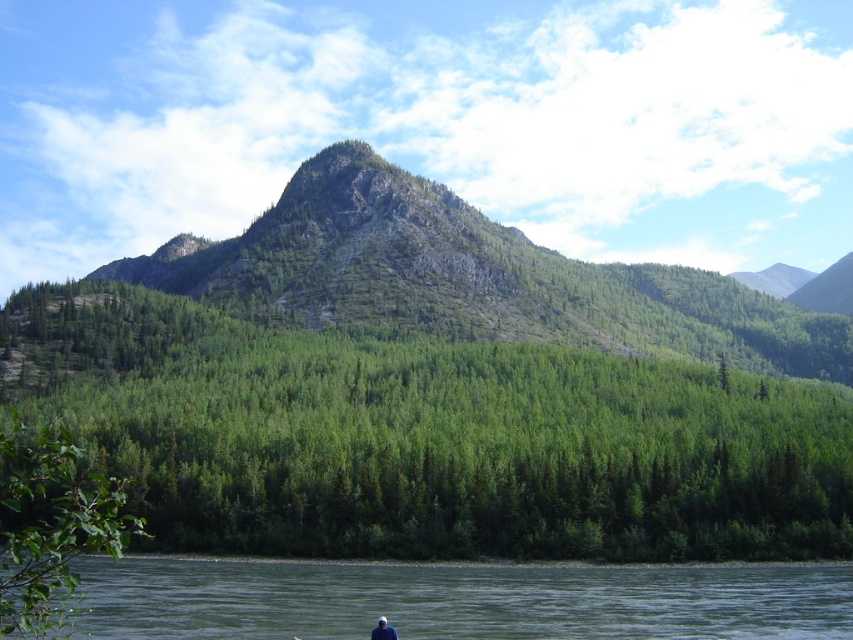
Who is more distant from viewer, (401, 515) or (390, 637)?

The point (401, 515) is more distant.

Measure the distance between green leafy forest at center and camera.

green leafy forest at center is 136.74 meters from camera.

Image resolution: width=853 pixels, height=640 pixels. I want to click on green leafy forest at center, so click(x=422, y=436).

Does green smooth water at lower center come in front of blue fabric person at lower center?

Yes, it is.

Consider the image. Does green smooth water at lower center have a lesser width compared to blue fabric person at lower center?

In fact, green smooth water at lower center might be wider than blue fabric person at lower center.

Where is `green smooth water at lower center`? This screenshot has height=640, width=853. green smooth water at lower center is located at coordinates (457, 598).

Does green leafy forest at center have a lesser width compared to green smooth water at lower center?

No.

At what (x,y) coordinates should I click in order to perform the action: click on green leafy forest at center. Please return your answer as a coordinate pair (x, y). Looking at the image, I should click on (422, 436).

Measure the distance between green leafy forest at center and camera.

green leafy forest at center is 136.74 meters from camera.

In order to click on green leafy forest at center in this screenshot , I will do `click(422, 436)`.